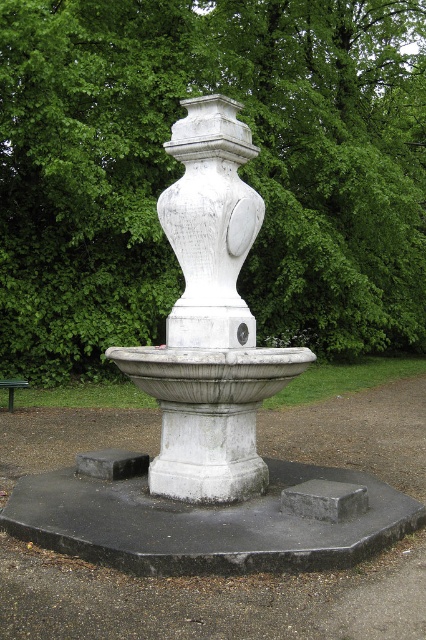
Question: Which of the following is the closest to the observer?

Choices:
 (A) (396, 84)
 (B) (198, 317)

Answer: (B)

Question: In this image, where is green leafy tree at upper center located relative to white stone vase at center?

Choices:
 (A) above
 (B) below

Answer: (A)

Question: Which object appears farthest from the camera in this image?

Choices:
 (A) white marble fountain at center
 (B) green leafy tree at upper center
 (C) white stone vase at center

Answer: (B)

Question: Is green leafy tree at upper center wider than green metallic park bench at lower left?

Choices:
 (A) yes
 (B) no

Answer: (A)

Question: Can you confirm if green leafy tree at upper center is wider than white stone vase at center?

Choices:
 (A) no
 (B) yes

Answer: (B)

Question: Based on their relative distances, which object is nearer to the green leafy tree at upper center?

Choices:
 (A) green metallic park bench at lower left
 (B) white marble fountain at center

Answer: (A)